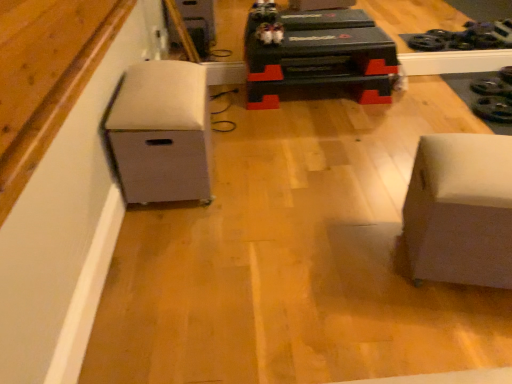
Question: Is white fabric storage bin at left, the 1th furniture from the left, wider or thinner than white matte ottoman at right, acting as the 1th furniture starting from the right?

Choices:
 (A) wide
 (B) thin

Answer: (A)

Question: Considering the positions of point (122, 97) and point (500, 178), is point (122, 97) closer or farther from the camera than point (500, 178)?

Choices:
 (A) farther
 (B) closer

Answer: (A)

Question: Which is nearer to the white fabric storage bin at left, the 1th furniture from the left?

Choices:
 (A) white matte wood at lower left
 (B) white matte ottoman at right, acting as the 1th furniture starting from the right

Answer: (A)

Question: Which of these objects is positioned closest to the white matte ottoman at right, acting as the 1th furniture starting from the right?

Choices:
 (A) white fabric storage bin at left, the 1th furniture from the left
 (B) white matte wood at lower left

Answer: (A)